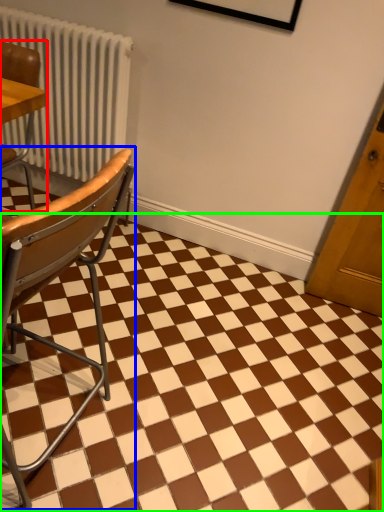
Question: Based on their relative distances, which object is farther from chair (highlighted by a red box)? Choose from chair (highlighted by a blue box) and square (highlighted by a green box).

Choices:
 (A) chair
 (B) square

Answer: (B)